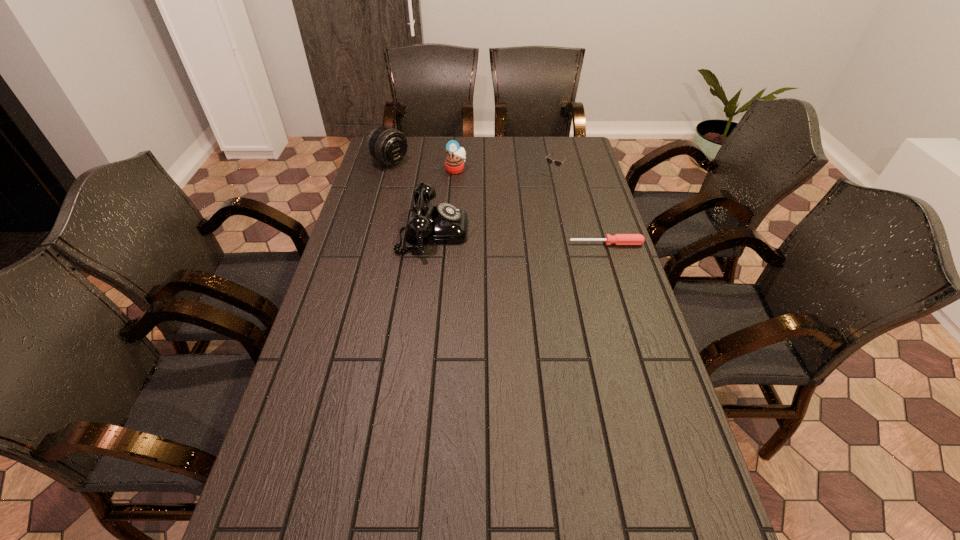
In order to click on free space between the telephone and the muffin in this screenshot , I will do `click(444, 200)`.

Identify the location of free space between the telephone and the shortest object. (519, 237).

Where is `empty space between the screwdriver and the telephoto lens`? The image size is (960, 540). empty space between the screwdriver and the telephoto lens is located at coordinates (498, 202).

Locate an element on the screen. This screenshot has height=540, width=960. vacant region between the telephone and the sunglasses is located at coordinates (492, 202).

Find the location of a particular element. The height and width of the screenshot is (540, 960). vacant space that is in between the screwdriver and the muffin is located at coordinates (531, 207).

Identify the location of free space that is in between the shortest object and the telephone. (519, 237).

Image resolution: width=960 pixels, height=540 pixels. In order to click on free space that is in between the telephone and the muffin in this screenshot , I will do `click(444, 200)`.

At what (x,y) coordinates should I click in order to perform the action: click on vacant space that is in between the shortest object and the telephone. Please return your answer as a coordinate pair (x, y). Image resolution: width=960 pixels, height=540 pixels. Looking at the image, I should click on (519, 237).

The height and width of the screenshot is (540, 960). What are the coordinates of `object that ranks as the third closest to the sunglasses` in the screenshot? It's located at (618, 239).

Point out which object is positioned as the nearest to the muffin. Please provide its 2D coordinates. Your answer should be formatted as a tuple, i.e. [(x, y)], where the tuple contains the x and y coordinates of a point satisfying the conditions above.

[(387, 145)]